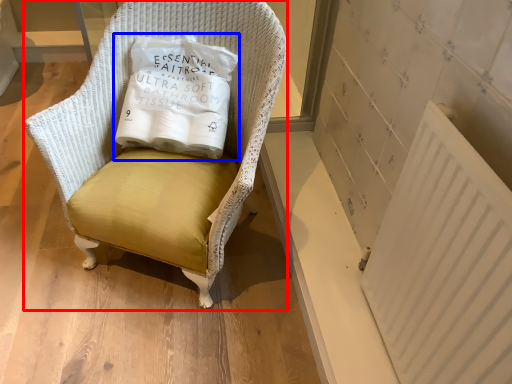
Question: Which of the following is the closest to the observer, chair (highlighted by a red box) or pillow (highlighted by a blue box)?

Choices:
 (A) chair
 (B) pillow

Answer: (A)